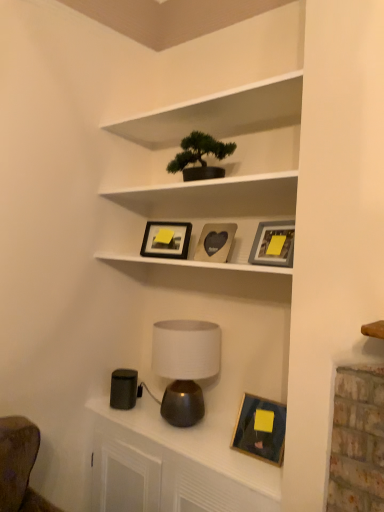
What do you see at coordinates (273, 244) in the screenshot? I see `matte gray picture frame at upper center, the 3th picture frame when ordered from top to bottom` at bounding box center [273, 244].

What do you see at coordinates (215, 242) in the screenshot? This screenshot has height=512, width=384. I see `wooden heart-shaped photo frame at center, which is the second picture frame from top to bottom` at bounding box center [215, 242].

This screenshot has width=384, height=512. In order to click on wooden heart-shaped photo frame at center, which is the second picture frame from top to bottom in this screenshot , I will do `click(215, 242)`.

What do you see at coordinates (260, 431) in the screenshot? The height and width of the screenshot is (512, 384). I see `wooden picture frame at lower right, positioned as the 1th picture frame in bottom-to-top order` at bounding box center [260, 431].

What do you see at coordinates (166, 239) in the screenshot? Image resolution: width=384 pixels, height=512 pixels. I see `matte black picture frame at upper center, acting as the 4th picture frame starting from the bottom` at bounding box center [166, 239].

Find the location of a particular element. The width and height of the screenshot is (384, 512). matte gray picture frame at upper center, the second picture frame from the bottom is located at coordinates coord(273,244).

From a real-world perspective, between wooden heart-shaped photo frame at center, which is the second picture frame from top to bottom, and white matte shelf at upper center, who is vertically higher?

white matte shelf at upper center.

Based on the photo, does wooden heart-shaped photo frame at center, which is the second picture frame from top to bottom, contain white matte shelf at upper center?

No, white matte shelf at upper center is not surrounded by wooden heart-shaped photo frame at center, which is the second picture frame from top to bottom.

Which point is more forward, (x=217, y=229) or (x=276, y=166)?

The point (x=276, y=166) is in front.

Would you consider wooden heart-shaped photo frame at center, which is the third picture frame in bottom-to-top order, to be distant from white matte shelf at upper center?

They are positioned close to each other.

Does point (201, 164) come behind point (206, 243)?

No, (201, 164) is in front of (206, 243).

Between green matte bonsai tree at upper center and wooden heart-shaped photo frame at center, which is the third picture frame in bottom-to-top order, which one appears on the right side from the viewer's perspective?

wooden heart-shaped photo frame at center, which is the third picture frame in bottom-to-top order, is more to the right.

Consider the image. Could you tell me if green matte bonsai tree at upper center is facing wooden heart-shaped photo frame at center, which is the third picture frame in bottom-to-top order?

No.

Is green matte bonsai tree at upper center wider or thinner than wooden heart-shaped photo frame at center, which is the third picture frame in bottom-to-top order?

green matte bonsai tree at upper center is wider than wooden heart-shaped photo frame at center, which is the third picture frame in bottom-to-top order.

From the picture: From a real-world perspective, which object stands above the other?

matte brown table lamp at center, from a real-world perspective.

Is metallic lamp at lower center to the left of matte brown table lamp at center from the viewer's perspective?

Incorrect, metallic lamp at lower center is not on the left side of matte brown table lamp at center.

How different are the orientations of metallic lamp at lower center and matte brown table lamp at center in degrees?

The facing directions of metallic lamp at lower center and matte brown table lamp at center are 0.391 degrees apart.

From a real-world perspective, which object rests below the other?

wooden picture frame at lower right, marked as the fourth picture frame in a top-to-bottom arrangement, is physically lower.

Measure the distance between wooden picture frame at lower right, marked as the fourth picture frame in a top-to-bottom arrangement, and wooden heart-shaped photo frame at center, which is the second picture frame from top to bottom.

wooden picture frame at lower right, marked as the fourth picture frame in a top-to-bottom arrangement, and wooden heart-shaped photo frame at center, which is the second picture frame from top to bottom, are 26.96 inches apart from each other.

From the image's perspective, is wooden picture frame at lower right, positioned as the 1th picture frame in bottom-to-top order, located above wooden heart-shaped photo frame at center, which is the second picture frame from top to bottom?

No, from the image's perspective, wooden picture frame at lower right, positioned as the 1th picture frame in bottom-to-top order, is not over wooden heart-shaped photo frame at center, which is the second picture frame from top to bottom.

Considering the sizes of wooden picture frame at lower right, marked as the fourth picture frame in a top-to-bottom arrangement, and wooden heart-shaped photo frame at center, which is the second picture frame from top to bottom, in the image, is wooden picture frame at lower right, marked as the fourth picture frame in a top-to-bottom arrangement, wider or thinner than wooden heart-shaped photo frame at center, which is the second picture frame from top to bottom,?

Clearly, wooden picture frame at lower right, marked as the fourth picture frame in a top-to-bottom arrangement, has more width compared to wooden heart-shaped photo frame at center, which is the second picture frame from top to bottom.

Is green matte bonsai tree at upper center at the back of matte brown table lamp at center?

matte brown table lamp at center is not turned away from green matte bonsai tree at upper center.

Considering the positions of objects matte brown table lamp at center and green matte bonsai tree at upper center in the image provided, who is more to the right, matte brown table lamp at center or green matte bonsai tree at upper center?

From the viewer's perspective, green matte bonsai tree at upper center appears more on the right side.

In terms of height, does matte brown table lamp at center look taller or shorter compared to green matte bonsai tree at upper center?

Clearly, matte brown table lamp at center is taller compared to green matte bonsai tree at upper center.

Does point (211, 358) come in front of point (171, 169)?

That is True.

From the image's perspective, between metallic lamp at lower center and green matte bonsai tree at upper center, who is located below?

From the image's view, metallic lamp at lower center is below.

Who is bigger, metallic lamp at lower center or green matte bonsai tree at upper center?

metallic lamp at lower center is bigger.

Is point (110, 428) behind point (199, 141)?

Yes, it is.

Is metallic lamp at lower center spatially inside green matte bonsai tree at upper center, or outside of it?

metallic lamp at lower center is spatially situated outside green matte bonsai tree at upper center.

Is wooden picture frame at lower right, positioned as the 1th picture frame in bottom-to-top order, positioned before metallic lamp at lower center?

No, the depth of wooden picture frame at lower right, positioned as the 1th picture frame in bottom-to-top order, is greater than that of metallic lamp at lower center.

Does point (253, 428) lie behind point (193, 446)?

That is False.

Choose the correct answer: Is wooden picture frame at lower right, positioned as the 1th picture frame in bottom-to-top order, inside metallic lamp at lower center or outside it?

wooden picture frame at lower right, positioned as the 1th picture frame in bottom-to-top order, is spatially situated outside metallic lamp at lower center.

The image size is (384, 512). I want to click on dresser below the wooden picture frame at lower right, marked as the fourth picture frame in a top-to-bottom arrangement (from a real-world perspective), so click(174, 464).

This screenshot has width=384, height=512. There is a white matte shelf at upper center. Identify the location of the 1st picture frame below it (from a real-world perspective). [215, 242].

Locate an element on the screen. This screenshot has height=512, width=384. houseplant to the left of wooden heart-shaped photo frame at center, which is the second picture frame from top to bottom is located at coordinates (x=200, y=157).

Estimate the real-world distances between objects in this image. Which object is further from matte black picture frame at upper center, the first picture frame when ordered from top to bottom, wooden heart-shaped photo frame at center, which is the third picture frame in bottom-to-top order, or matte gray picture frame at upper center, the second picture frame from the bottom?

matte gray picture frame at upper center, the second picture frame from the bottom, is further to matte black picture frame at upper center, the first picture frame when ordered from top to bottom.

Considering their positions, is green matte bonsai tree at upper center positioned closer to matte gray picture frame at upper center, the 3th picture frame when ordered from top to bottom, than wooden picture frame at lower right, marked as the fourth picture frame in a top-to-bottom arrangement?

green matte bonsai tree at upper center is positioned closer to the anchor matte gray picture frame at upper center, the 3th picture frame when ordered from top to bottom.

Considering their positions, is green matte bonsai tree at upper center positioned closer to matte black picture frame at upper center, acting as the 4th picture frame starting from the bottom, than wooden picture frame at lower right, positioned as the 1th picture frame in bottom-to-top order?

The object closer to matte black picture frame at upper center, acting as the 4th picture frame starting from the bottom, is green matte bonsai tree at upper center.

From the image, which object appears to be nearer to matte black picture frame at upper center, the first picture frame when ordered from top to bottom, green matte bonsai tree at upper center or matte brown table lamp at center?

green matte bonsai tree at upper center is closer to matte black picture frame at upper center, the first picture frame when ordered from top to bottom.

Estimate the real-world distances between objects in this image. Which object is further from green matte bonsai tree at upper center, metallic lamp at lower center or white matte shelf at upper center?

Based on the image, metallic lamp at lower center appears to be further to green matte bonsai tree at upper center.

Which object lies nearer to the anchor point wooden heart-shaped photo frame at center, which is the third picture frame in bottom-to-top order, matte brown table lamp at center or wooden picture frame at lower right, positioned as the 1th picture frame in bottom-to-top order?

matte brown table lamp at center is closer to wooden heart-shaped photo frame at center, which is the third picture frame in bottom-to-top order.

Which object lies nearer to the anchor point wooden picture frame at lower right, positioned as the 1th picture frame in bottom-to-top order, matte gray picture frame at upper center, the 3th picture frame when ordered from top to bottom, or white matte shelf at upper center?

matte gray picture frame at upper center, the 3th picture frame when ordered from top to bottom, lies closer to wooden picture frame at lower right, positioned as the 1th picture frame in bottom-to-top order, than the other object.

Which object lies further to the anchor point white matte shelf at upper center, metallic lamp at lower center or green matte bonsai tree at upper center?

The object further to white matte shelf at upper center is metallic lamp at lower center.

The width and height of the screenshot is (384, 512). Identify the location of houseplant between matte black picture frame at upper center, acting as the 4th picture frame starting from the bottom, and matte gray picture frame at upper center, the second picture frame from the bottom, from left to right. (200, 157).

Image resolution: width=384 pixels, height=512 pixels. Identify the location of picture frame between matte gray picture frame at upper center, the second picture frame from the bottom, and metallic lamp at lower center vertically. (260, 431).

Identify the location of table lamp that lies between wooden heart-shaped photo frame at center, which is the third picture frame in bottom-to-top order, and wooden picture frame at lower right, marked as the fourth picture frame in a top-to-bottom arrangement, from top to bottom. The width and height of the screenshot is (384, 512). (185, 366).

Identify the location of shelf between green matte bonsai tree at upper center and matte brown table lamp at center in the vertical direction. This screenshot has width=384, height=512. (219, 164).